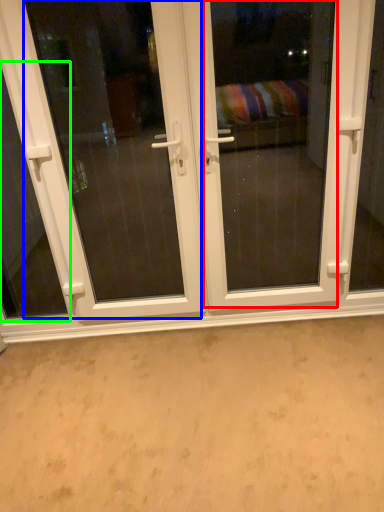
Question: Which object is the closest to the screen door (highlighted by a red box)? Choose among these: screen door (highlighted by a blue box) or window (highlighted by a green box).

Choices:
 (A) screen door
 (B) window

Answer: (A)